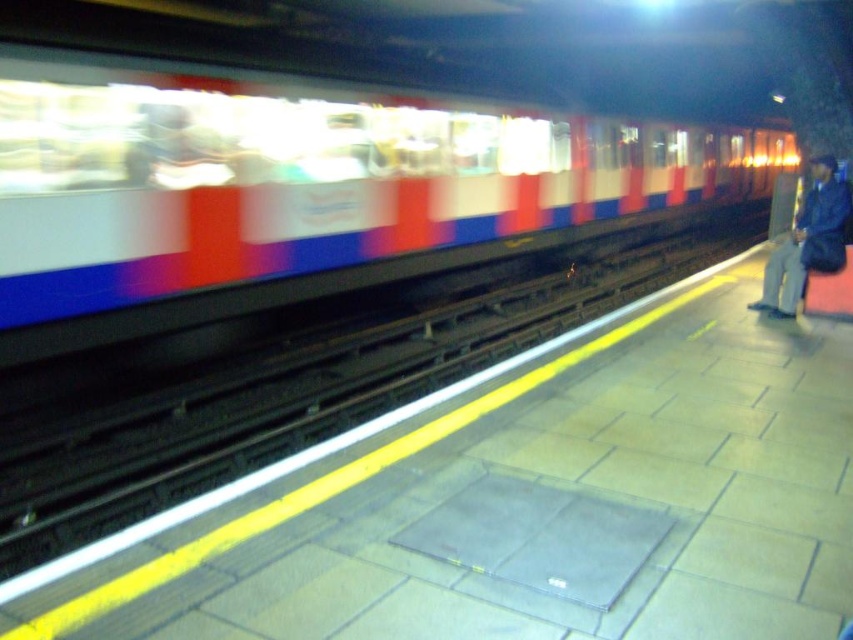
You are a photographer trying to capture the blue denim jacket at right while the white glossy train at center is passing by. Since the train is moving, will its width block the jacket from your view?

The white glossy train at center is wider than the blue denim jacket at right, so it may block the jacket from view depending on the angle and distance.

You are a passenger waiting at the subway station and see the white glossy train at center approaching. You are standing near the blue denim jacket at right. Will the train pass in front of you or behind you?

The white glossy train at center is in front of blue denim jacket at right, so the train will pass in front of you as you are near the blue denim jacket at right.

You are a passenger waiting at the subway station platform. You see the white glossy train at center and the blue denim jacket at right. Which object is closer to you from your position on the platform?

The blue denim jacket at right is closer to you because the white glossy train at center is positioned over it, indicating the train is farther away.